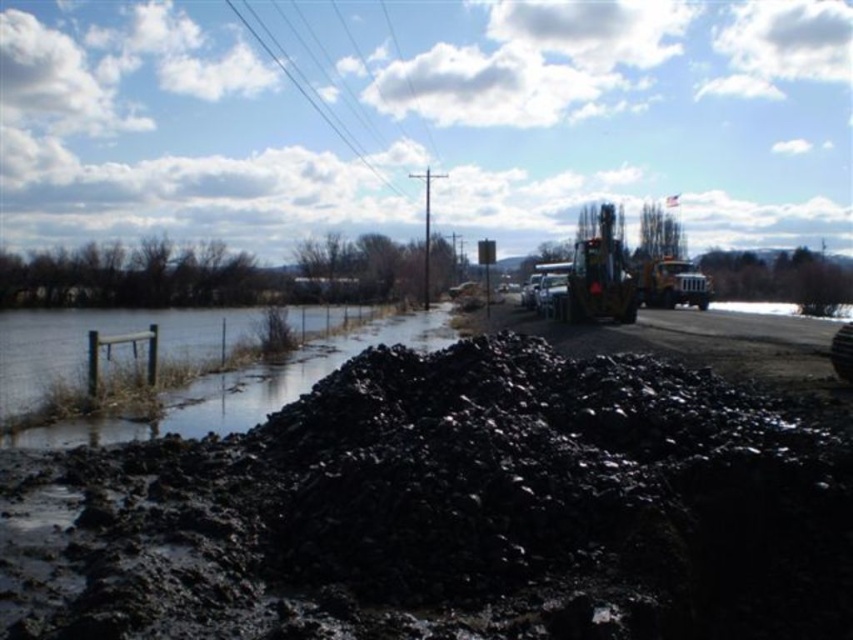
Question: Is clear water at fence left smaller than greenish-brown metallic excavator at center-right?

Choices:
 (A) no
 (B) yes

Answer: (B)

Question: Among these points, which one is farthest from the camera?

Choices:
 (A) (622, 260)
 (B) (202, 387)

Answer: (A)

Question: Is black mud at center further to the viewer compared to greenish-brown metallic excavator at center-right?

Choices:
 (A) yes
 (B) no

Answer: (B)

Question: Does black mud at center appear on the right side of greenish-brown metallic excavator at center-right?

Choices:
 (A) no
 (B) yes

Answer: (A)

Question: Which of the following is the closest to the observer?

Choices:
 (A) (148, 422)
 (B) (676, 289)

Answer: (A)

Question: Which object is closer to the camera taking this photo?

Choices:
 (A) clear water at fence left
 (B) metallic silver trailer truck at right
 (C) black mud at center
 (D) greenish-brown metallic excavator at center-right

Answer: (C)